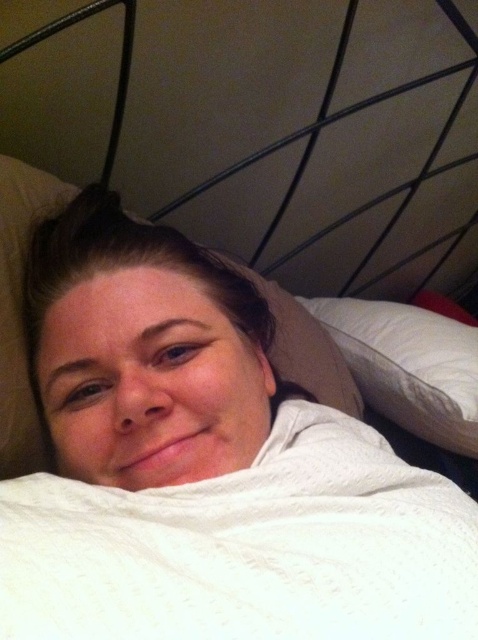
Can you confirm if metallic black headboard at upper center is positioned above white soft pillow at center?

Yes, metallic black headboard at upper center is above white soft pillow at center.

Is metallic black headboard at upper center closer to camera compared to white soft pillow at center?

Yes, metallic black headboard at upper center is in front of white soft pillow at center.

Between point (469, 193) and point (469, 410), which one is positioned behind?

The point (469, 193) is more distant.

Identify the location of metallic black headboard at upper center. This screenshot has width=478, height=640. (271, 129).

Between metallic black headboard at upper center and white knitted blanket at center, which one has less height?

white knitted blanket at center is shorter.

Between metallic black headboard at upper center and white knitted blanket at center, which one appears on the left side from the viewer's perspective?

white knitted blanket at center is more to the left.

Is point (91, 141) positioned behind point (313, 538)?

Yes, point (91, 141) is behind point (313, 538).

This screenshot has width=478, height=640. In order to click on metallic black headboard at upper center in this screenshot , I will do `click(271, 129)`.

Which of these two, white knitted blanket at center or white soft pillow at center, stands taller?

white soft pillow at center

Between point (43, 609) and point (369, 385), which one is positioned behind?

Positioned behind is point (369, 385).

Where is `white knitted blanket at center`? white knitted blanket at center is located at coordinates (248, 547).